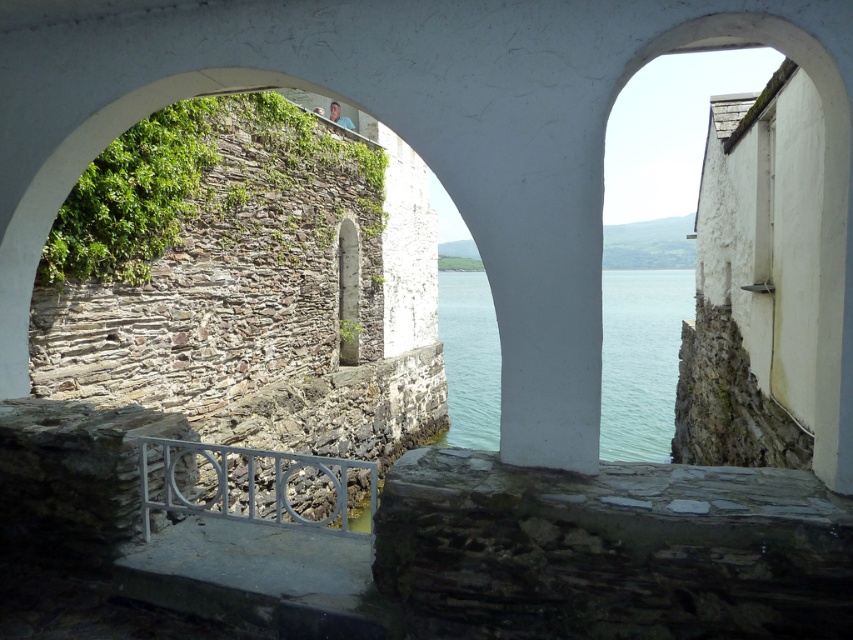
You are standing on the walkway and want to take a photo of the clear water at center. Since the metallic gray railing at lower center is in the way, can you move the railing to get a better view?

The metallic gray railing at lower center is part of the structure and cannot be moved, so you cannot move the railing to get a better view of the clear water at center.

You are standing at the base of the stone structure with the two white arches. You want to find the clear water at center. According to the coordinates given, where should you look relative to the arches?

The clear water at center is located at coordinates point (641, 358), which is to the right and slightly below the central point of the image. Since the arches frame the scene, you should look through the arches towards the lower right direction to find the clear water at center.

From the picture: You are standing on the walkway and see the clear water at center and the metallic gray railing at lower center. Which object is closer to your viewpoint?

The metallic gray railing at lower center is closer to your viewpoint because it is positioned under the clear water at center, making the water appear further away.